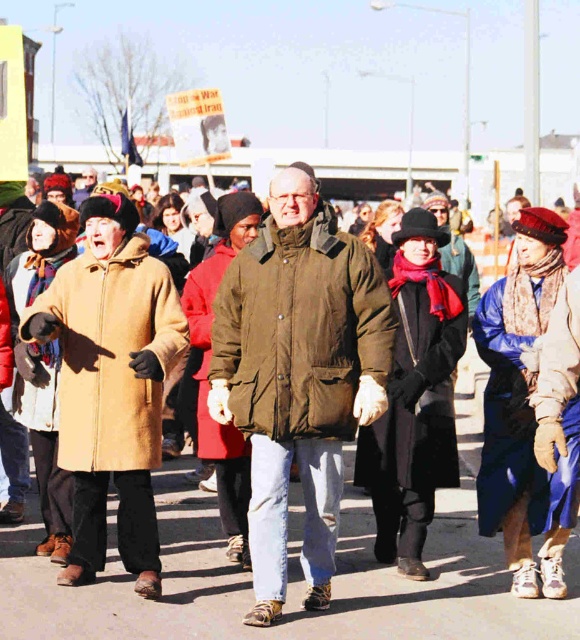
Does brown wool coat at center have a smaller size compared to olive-green parka at center?

No.

Is brown wool coat at center thinner than olive-green parka at center?

Incorrect, brown wool coat at center's width is not less than olive-green parka at center's.

Who is more forward, (x=450, y=593) or (x=253, y=276)?

Point (x=253, y=276) is in front.

Find the location of a particular element. This screenshot has width=580, height=640. brown wool coat at center is located at coordinates (290, 573).

Does olive-green parka at center appear over beige wool coat at left?

Yes.

Does olive-green parka at center have a greater height compared to beige wool coat at left?

No, olive-green parka at center is not taller than beige wool coat at left.

Does point (274, 408) lie behind point (108, 284)?

No, (274, 408) is in front of (108, 284).

Where is `olive-green parka at center`? olive-green parka at center is located at coordinates (300, 330).

Is brown wool coat at center positioned in front of beige wool coat at left?

Yes, brown wool coat at center is in front of beige wool coat at left.

Measure the distance between brown wool coat at center and camera.

The distance of brown wool coat at center from camera is 5.22 meters.

What do you see at coordinates (290, 573) in the screenshot? The width and height of the screenshot is (580, 640). I see `brown wool coat at center` at bounding box center [290, 573].

The width and height of the screenshot is (580, 640). Identify the location of brown wool coat at center. (290, 573).